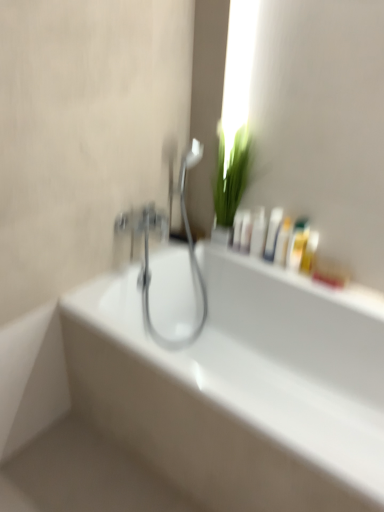
What do you see at coordinates (309, 252) in the screenshot?
I see `yellow plastic bottle at upper right, arranged as the first mouthwash when viewed from the right` at bounding box center [309, 252].

Image resolution: width=384 pixels, height=512 pixels. What do you see at coordinates (282, 242) in the screenshot? I see `white glossy bottle at upper right, which ranks as the fifth mouthwash in left-to-right order` at bounding box center [282, 242].

In order to face white glossy bottles at upper center, marked as the third mouthwash in a left-to-right arrangement, should I rotate leftwards or rightwards?

To align with it, rotate right about 8.966°.

What is the approximate width of white glossy bottles at upper center?

The width of white glossy bottles at upper center is 1.90 inches.

Locate an element on the screen. white glossy bathtub at center is located at coordinates (235, 379).

I want to click on window sill on the right of white glossy bottle at upper right, which is counted as the seventh mouthwash, starting from the right, so click(x=312, y=284).

Looking at this image, from a real-world perspective, is white glossy bottles at upper center below white glossy bottle at upper right, which is counted as the seventh mouthwash, starting from the right?

Yes.

Which of these two, white glossy bottles at upper center or white glossy bottle at upper right, arranged as the 1th mouthwash when viewed from the left, is bigger?

With larger size is white glossy bottles at upper center.

Could you tell me if white glossy bottles at upper center is turned towards white glossy bottle at upper right, which is counted as the seventh mouthwash, starting from the right?

No, white glossy bottles at upper center is not turned towards white glossy bottle at upper right, which is counted as the seventh mouthwash, starting from the right.

Between white glossy bottle at upper right, arranged as the 1th mouthwash when viewed from the left, and white glossy bottle at upper right, which ranks as the fifth mouthwash in left-to-right order, which one has smaller width?

white glossy bottle at upper right, arranged as the 1th mouthwash when viewed from the left, is thinner.

Is white glossy bottle at upper right, arranged as the 1th mouthwash when viewed from the left, positioned with its back to white glossy bottle at upper right, which ranks as the fifth mouthwash in left-to-right order?

No, white glossy bottle at upper right, which ranks as the fifth mouthwash in left-to-right order, is not at the back of white glossy bottle at upper right, arranged as the 1th mouthwash when viewed from the left.

Considering the sizes of objects white glossy bottle at upper right, which is counted as the seventh mouthwash, starting from the right, and white glossy bottle at upper right, which is the third mouthwash from right to left, in the image provided, who is smaller, white glossy bottle at upper right, which is counted as the seventh mouthwash, starting from the right, or white glossy bottle at upper right, which is the third mouthwash from right to left,?

white glossy bottle at upper right, which is counted as the seventh mouthwash, starting from the right.

Which object is positioned more to the left, white glossy bottles at upper center, marked as the third mouthwash in a left-to-right arrangement, or white glossy bottle at upper center, which appears as the sixth mouthwash when viewed from the right?

white glossy bottle at upper center, which appears as the sixth mouthwash when viewed from the right, is more to the left.

Considering the positions of objects white glossy bottles at upper center, placed as the 5th mouthwash when sorted from right to left, and white glossy bottle at upper center, which appears as the sixth mouthwash when viewed from the right, in the image provided, who is in front, white glossy bottles at upper center, placed as the 5th mouthwash when sorted from right to left, or white glossy bottle at upper center, which appears as the sixth mouthwash when viewed from the right,?

white glossy bottles at upper center, placed as the 5th mouthwash when sorted from right to left, is more forward.

Is white glossy bottles at upper center positioned with its back to green leafy plant at upper center?

No.

How many degrees apart are the facing directions of white glossy bottles at upper center and green leafy plant at upper center?

The angular difference between white glossy bottles at upper center and green leafy plant at upper center is 1.07 degrees.

In the image, is white glossy bottles at upper center positioned in front of or behind green leafy plant at upper center?

Visually, white glossy bottles at upper center is located behind green leafy plant at upper center.

Who is shorter, white glossy bottles at upper center or green leafy plant at upper center?

white glossy bottles at upper center is shorter.

Can you confirm if yellow plastic bottle at upper right, which is counted as the 7th mouthwash, starting from the left, is taller than polished chrome faucet at center?

No, yellow plastic bottle at upper right, which is counted as the 7th mouthwash, starting from the left, is not taller than polished chrome faucet at center.

Does yellow plastic bottle at upper right, arranged as the first mouthwash when viewed from the right, turn towards polished chrome faucet at center?

No, yellow plastic bottle at upper right, arranged as the first mouthwash when viewed from the right, does not turn towards polished chrome faucet at center.

Could you measure the distance between yellow plastic bottle at upper right, which is counted as the 7th mouthwash, starting from the left, and polished chrome faucet at center?

60.89 centimeters.

From a real-world perspective, relative to polished chrome faucet at center, is yellow plastic bottle at upper right, which is counted as the 7th mouthwash, starting from the left, vertically above or below?

→ Clearly, from a real-world perspective, yellow plastic bottle at upper right, which is counted as the 7th mouthwash, starting from the left, is above polished chrome faucet at center.

Between white glossy bottle at upper right, the fourth mouthwash in the right-to-left sequence, and white glossy bottle at upper right, which is counted as the seventh mouthwash, starting from the right, which one has more height?

white glossy bottle at upper right, the fourth mouthwash in the right-to-left sequence.

Considering the sizes of white glossy bottle at upper right, the fourth mouthwash in the right-to-left sequence, and white glossy bottle at upper right, which is counted as the seventh mouthwash, starting from the right, in the image, is white glossy bottle at upper right, the fourth mouthwash in the right-to-left sequence, wider or thinner than white glossy bottle at upper right, which is counted as the seventh mouthwash, starting from the right,?

In the image, white glossy bottle at upper right, the fourth mouthwash in the right-to-left sequence, appears to be wider than white glossy bottle at upper right, which is counted as the seventh mouthwash, starting from the right.

Can you tell me how much white glossy bottle at upper right, positioned as the 4th mouthwash in left-to-right order, and white glossy bottle at upper right, which is counted as the seventh mouthwash, starting from the right, differ in facing direction?

There is a 11.8-degree angle between the facing directions of white glossy bottle at upper right, positioned as the 4th mouthwash in left-to-right order, and white glossy bottle at upper right, which is counted as the seventh mouthwash, starting from the right.

Is white glossy bottle at upper right, positioned as the 4th mouthwash in left-to-right order, looking in the opposite direction of white glossy bottle at upper right, which is counted as the seventh mouthwash, starting from the right?

No, white glossy bottle at upper right, positioned as the 4th mouthwash in left-to-right order, is not facing the opposite direction of white glossy bottle at upper right, which is counted as the seventh mouthwash, starting from the right.

Which object is thinner, white glossy bottles at upper center or white glossy bathtub at center?

With smaller width is white glossy bottles at upper center.

Measure the distance from white glossy bottles at upper center to white glossy bathtub at center.

white glossy bottles at upper center and white glossy bathtub at center are 16.57 inches apart from each other.

Is white glossy bottles at upper center next to white glossy bathtub at center and touching it?

white glossy bottles at upper center and white glossy bathtub at center are clearly separated.

Can you tell me how much white glossy bottles at upper center and white glossy bathtub at center differ in facing direction?

The angle between the facing direction of white glossy bottles at upper center and the facing direction of white glossy bathtub at center is 8.8e-05 degrees.

Where is `window sill lying in front of the white glossy bottle at upper right, arranged as the 1th mouthwash when viewed from the left`? The width and height of the screenshot is (384, 512). window sill lying in front of the white glossy bottle at upper right, arranged as the 1th mouthwash when viewed from the left is located at coordinates (312, 284).

Where is `the 4th mouthwash to the right of the white glossy bottle at upper right, which is counted as the seventh mouthwash, starting from the right, counting from the anchor's position`? This screenshot has width=384, height=512. the 4th mouthwash to the right of the white glossy bottle at upper right, which is counted as the seventh mouthwash, starting from the right, counting from the anchor's position is located at coordinates (282, 242).

Looking at the image, which one is located closer to white glossy bathtub at center, white glossy bottle at upper right, which ranks as the fifth mouthwash in left-to-right order, or white glossy bottle at upper right, positioned as the 4th mouthwash in left-to-right order?

Based on the image, white glossy bottle at upper right, which ranks as the fifth mouthwash in left-to-right order, appears to be nearer to white glossy bathtub at center.

Considering their positions, is white glossy bottle at upper right, the fourth mouthwash in the right-to-left sequence, positioned closer to white glossy bottle at upper right, arranged as the 1th mouthwash when viewed from the left, than white glossy bathtub at center?

white glossy bottle at upper right, the fourth mouthwash in the right-to-left sequence, lies closer to white glossy bottle at upper right, arranged as the 1th mouthwash when viewed from the left, than the other object.

From the image, which object appears to be farther from green leafy plant at upper center, white glossy bathtub at center or polished chrome faucet at center?

Among the two, white glossy bathtub at center is located further to green leafy plant at upper center.

From the image, which object appears to be farther from white glossy bottle at upper right, which ranks as the fifth mouthwash in left-to-right order, white glossy bottle at upper center, which appears as the sixth mouthwash when viewed from the right, or white glossy bottles at upper center?

white glossy bottles at upper center is further to white glossy bottle at upper right, which ranks as the fifth mouthwash in left-to-right order.

Looking at the image, which one is located closer to white glossy bottle at upper right, which ranks as the fifth mouthwash in left-to-right order, white glossy bottle at upper right, arranged as the 1th mouthwash when viewed from the left, or translucent plastic bottle at upper right, positioned as the sixth mouthwash in left-to-right order?

Based on the image, translucent plastic bottle at upper right, positioned as the sixth mouthwash in left-to-right order, appears to be nearer to white glossy bottle at upper right, which ranks as the fifth mouthwash in left-to-right order.

Considering their positions, is white glossy bottle at upper right, arranged as the 1th mouthwash when viewed from the left, positioned further to yellow plastic bottle at upper right, which is counted as the 7th mouthwash, starting from the left, than green leafy plant at upper center?

green leafy plant at upper center is further to yellow plastic bottle at upper right, which is counted as the 7th mouthwash, starting from the left.

Based on the photo, which object lies further to the anchor point white glossy bottles at upper center, white glossy bottle at upper right, which is the third mouthwash from right to left, or translucent plastic bottle at upper right, positioned as the sixth mouthwash in left-to-right order?

Among the two, white glossy bottle at upper right, which is the third mouthwash from right to left, is located further to white glossy bottles at upper center.

From the picture: Based on their spatial positions, is white glossy bathtub at center or yellow plastic bottle at upper right, arranged as the first mouthwash when viewed from the right, closer to white glossy bottle at upper right, which is the third mouthwash from right to left?

The object closer to white glossy bottle at upper right, which is the third mouthwash from right to left, is yellow plastic bottle at upper right, arranged as the first mouthwash when viewed from the right.

I want to click on plumbing fixture between white glossy bathtub at center and white glossy bottle at upper right, which is the third mouthwash from right to left, in the front-back direction, so click(x=164, y=237).

This screenshot has height=512, width=384. Identify the location of window sill between white glossy bottle at upper right, positioned as the 4th mouthwash in left-to-right order, and yellow plastic bottle at upper right, arranged as the first mouthwash when viewed from the right. (312, 284).

You are a GUI agent. You are given a task and a screenshot of the screen. Output one action in this format:
    pyautogui.click(x=<x>, y=<y>)
    Task: Click on the plant positioned between white glossy bathtub at center and white glossy bottle at upper center, the 2th mouthwash positioned from the left, from near to far
    
    Given the screenshot: What is the action you would take?
    pyautogui.click(x=232, y=175)

Find the location of a particular element. The height and width of the screenshot is (512, 384). plant positioned between white glossy bathtub at center and white glossy bottle at upper right, which is the third mouthwash from right to left, from near to far is located at coordinates (232, 175).